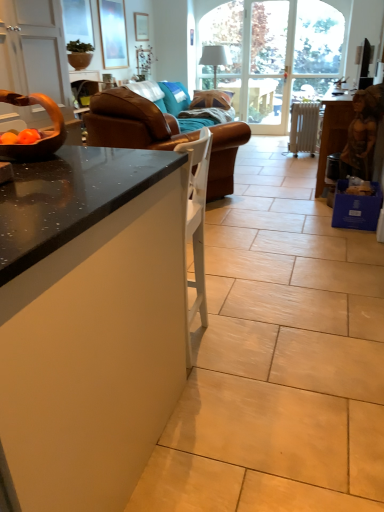
At what (x,y) coordinates should I click in order to perform the action: click on vacant area to the right of brown leather couch at center. Please return your answer as a coordinate pair (x, y). Looking at the image, I should click on (279, 196).